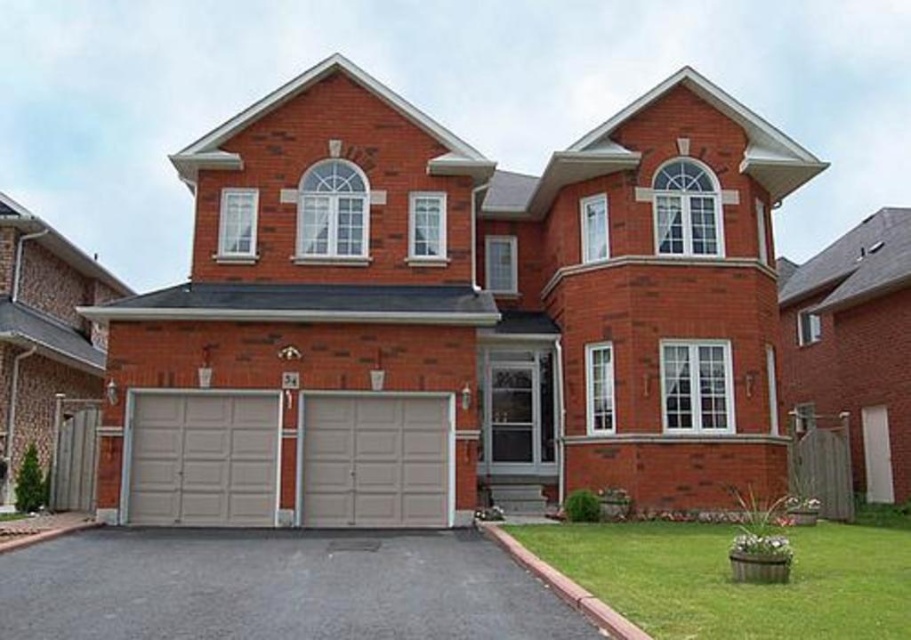
Question: Which of the following is the farthest from the observer?

Choices:
 (A) black asphalt driveway at center
 (B) matte gray garage door at center
 (C) green grass at lower right

Answer: (B)

Question: Which of the following is the farthest from the observer?

Choices:
 (A) black asphalt driveway at center
 (B) beige textured garage door at center

Answer: (B)

Question: Which object is farther from the camera taking this photo?

Choices:
 (A) beige textured garage door at center
 (B) black asphalt driveway at center
 (C) matte gray garage door at center
 (D) green grass at lower right

Answer: (A)

Question: Does green grass at lower right lie behind beige textured garage door at center?

Choices:
 (A) no
 (B) yes

Answer: (A)

Question: Does black asphalt driveway at center have a lesser width compared to matte gray garage door at center?

Choices:
 (A) yes
 (B) no

Answer: (B)

Question: Can you confirm if green grass at lower right is positioned to the left of beige textured garage door at center?

Choices:
 (A) yes
 (B) no

Answer: (B)